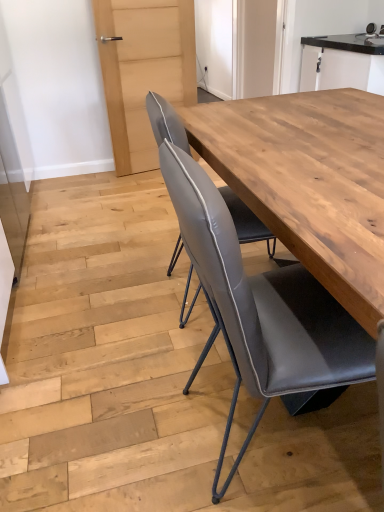
Measure the distance between natural wood table at center and camera.

The depth of natural wood table at center is 66.04 centimeters.

I want to click on natural wood table at center, so click(x=309, y=181).

Is natural wood table at center taller or shorter than matte gray leather chair at center?

In the image, natural wood table at center appears to be taller than matte gray leather chair at center.

Would you say natural wood table at center is to the left or to the right of matte gray leather chair at center in the picture?

natural wood table at center is positioned on matte gray leather chair at center's left side.

Is natural wood table at center positioned behind matte gray leather chair at center?

Yes.

Is natural wood table at center not near matte gray leather chair at center?

That's not correct — natural wood table at center is a little close to matte gray leather chair at center.

From the image's perspective, is black glossy cabinet at upper right positioned above or below natural wood table at center?

Based on their image positions, black glossy cabinet at upper right is located above natural wood table at center.

Find the location of `cabinetry on the right of natural wood table at center`. cabinetry on the right of natural wood table at center is located at coordinates (342, 63).

Is point (380, 40) less distant than point (203, 137)?

No.

Looking at the image, does black glossy cabinet at upper right seem bigger or smaller compared to natural wood table at center?

Clearly, black glossy cabinet at upper right is larger in size than natural wood table at center.

Considering the positions of objects natural wood table at center and black glossy cabinet at upper right in the image provided, who is more to the left, natural wood table at center or black glossy cabinet at upper right?

natural wood table at center.

In the image, there is a natural wood table at center. Find the location of `cabinetry above it (from the image's perspective)`. cabinetry above it (from the image's perspective) is located at coordinates (342, 63).

Can black glossy cabinet at upper right be found inside natural wood table at center?

No, black glossy cabinet at upper right is not a part of natural wood table at center.

From a real-world perspective, who is located lower, natural wood table at center or black glossy cabinet at upper right?

natural wood table at center is physically lower.

Consider the image. Considering the relative sizes of black glossy cabinet at upper right and matte gray leather chair at center in the image provided, is black glossy cabinet at upper right smaller than matte gray leather chair at center?

No, black glossy cabinet at upper right is not smaller than matte gray leather chair at center.

Consider the image. From the image's perspective, between black glossy cabinet at upper right and matte gray leather chair at center, who is located below?

matte gray leather chair at center appears lower in the image.

Is black glossy cabinet at upper right facing away from matte gray leather chair at center?

black glossy cabinet at upper right is not turned away from matte gray leather chair at center.

Is matte gray leather chair at center turned away from natural wood table at center?

No, matte gray leather chair at center is not facing the opposite direction of natural wood table at center.

How different are the orientations of matte gray leather chair at center and natural wood table at center in degrees?

matte gray leather chair at center and natural wood table at center are facing 2.15 degrees away from each other.

Can you confirm if matte gray leather chair at center is bigger than natural wood table at center?

Yes.

Is matte gray leather chair at center situated inside natural wood table at center or outside?

matte gray leather chair at center is outside natural wood table at center.

Considering the positions of point (267, 291) and point (372, 60), is point (267, 291) closer or farther from the camera than point (372, 60)?

Point (267, 291) is positioned closer to the camera compared to point (372, 60).

Between matte gray leather chair at center and black glossy cabinet at upper right, which one appears on the left side from the viewer's perspective?

Positioned to the left is matte gray leather chair at center.

Which is in front, matte gray leather chair at center or black glossy cabinet at upper right?

matte gray leather chair at center is in front.

This screenshot has height=512, width=384. In the image, there is a matte gray leather chair at center. What are the coordinates of `table above it (from the image's perspective)` in the screenshot? It's located at (309, 181).

Identify the location of table below the black glossy cabinet at upper right (from a real-world perspective). The width and height of the screenshot is (384, 512). (309, 181).

Estimate the real-world distances between objects in this image. Which object is further from natural wood table at center, matte gray leather chair at center or black glossy cabinet at upper right?

black glossy cabinet at upper right.

In the scene shown: When comparing their distances from natural wood table at center, does black glossy cabinet at upper right or matte gray leather chair at center seem closer?

matte gray leather chair at center.

From the image, which object appears to be farther from matte gray leather chair at center, natural wood table at center or black glossy cabinet at upper right?

The object further to matte gray leather chair at center is black glossy cabinet at upper right.

From the image, which object appears to be nearer to black glossy cabinet at upper right, matte gray leather chair at center or natural wood table at center?

natural wood table at center lies closer to black glossy cabinet at upper right than the other object.

Based on their spatial positions, is black glossy cabinet at upper right or natural wood table at center closer to matte gray leather chair at center?

The object closer to matte gray leather chair at center is natural wood table at center.

Looking at the image, which one is located closer to black glossy cabinet at upper right, natural wood table at center or matte gray leather chair at center?

natural wood table at center lies closer to black glossy cabinet at upper right than the other object.

Find the location of a particular element. table between matte gray leather chair at center and black glossy cabinet at upper right along the z-axis is located at coordinates (309, 181).